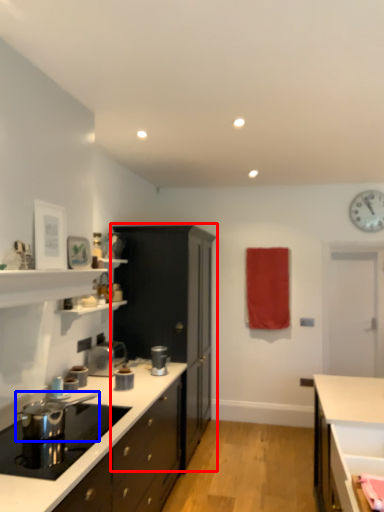
Question: Which object is closer to the camera taking this photo, cabinetry (highlighted by a red box) or appliance (highlighted by a blue box)?

Choices:
 (A) cabinetry
 (B) appliance

Answer: (B)